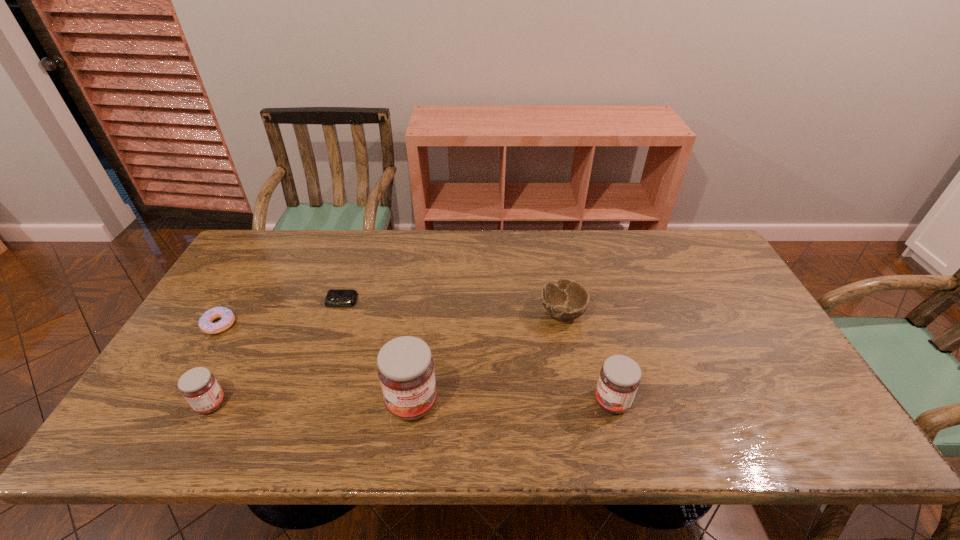
Identify the location of the leftmost jam. The width and height of the screenshot is (960, 540). (199, 387).

You are a GUI agent. You are given a task and a screenshot of the screen. Output one action in this format:
    pyautogui.click(x=<x>, y=<y>)
    Task: Click on the shortest jam
    
    Given the screenshot: What is the action you would take?
    pyautogui.click(x=199, y=387)

I want to click on the tallest object, so click(x=405, y=369).

I want to click on the tallest jam, so click(x=405, y=369).

Locate an element on the screen. the second tallest jam is located at coordinates (619, 379).

Locate an element on the screen. Image resolution: width=960 pixels, height=540 pixels. the rightmost jam is located at coordinates (619, 379).

At what (x,y) coordinates should I click in order to perform the action: click on the fourth tallest object. Please return your answer as a coordinate pair (x, y). The image size is (960, 540). Looking at the image, I should click on (567, 300).

I want to click on alarm clock, so tap(335, 297).

Image resolution: width=960 pixels, height=540 pixels. Find the location of `the shortest object`. the shortest object is located at coordinates (335, 297).

Find the location of a particular element. The width and height of the screenshot is (960, 540). the second shortest object is located at coordinates (227, 317).